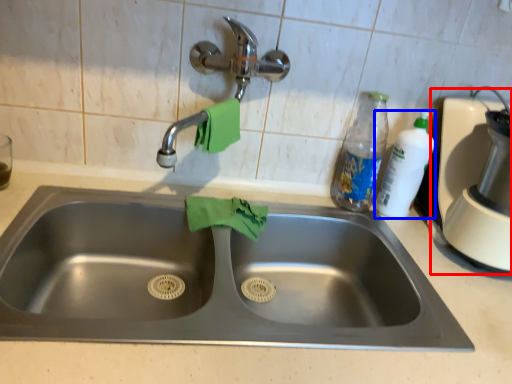
Question: Which object is further to the camera taking this photo, blender (highlighted by a red box) or cleaning product (highlighted by a blue box)?

Choices:
 (A) blender
 (B) cleaning product

Answer: (B)